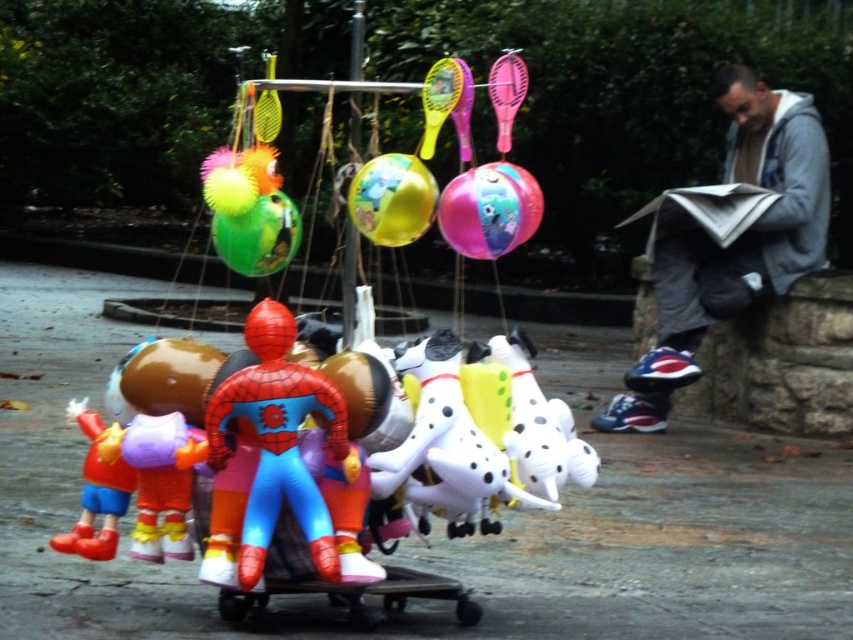
You are a customer at the fairground looking at the cart with the rubber inflatable spiderman at center and the translucent green balloon at center. If you want to reach the balloon, do you need to move the Spiderman first?

The rubber inflatable spiderman at center is positioned under the translucent green balloon at center, so you would need to move the Spiderman first to access the balloon.

Based on the photo, you are a child looking at the balloons above the cart. Which balloon is positioned to the right of the other, the glossy pink balloon at center or the shiny metallic balloon at center?

The glossy pink balloon at center is positioned to the right of the shiny metallic balloon at center.